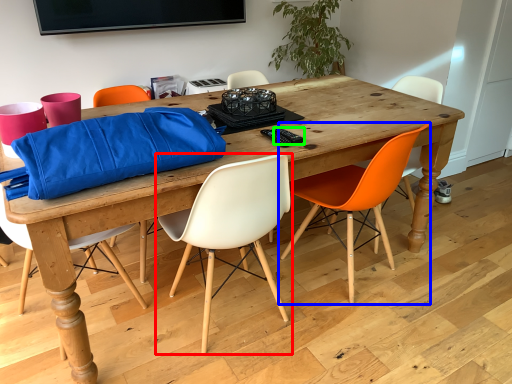
Question: Which object is positioned closest to chair (highlighted by a red box)? Select from chair (highlighted by a blue box) and remote control (highlighted by a green box).

Choices:
 (A) chair
 (B) remote control

Answer: (B)